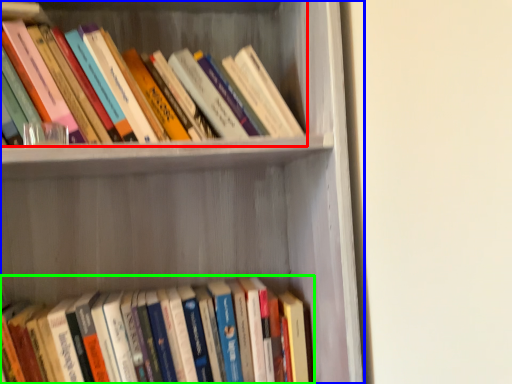
Question: Which object is positioned closest to book (highlighted by a red box)? Select from shelf (highlighted by a blue box) and book (highlighted by a green box).

Choices:
 (A) shelf
 (B) book

Answer: (A)